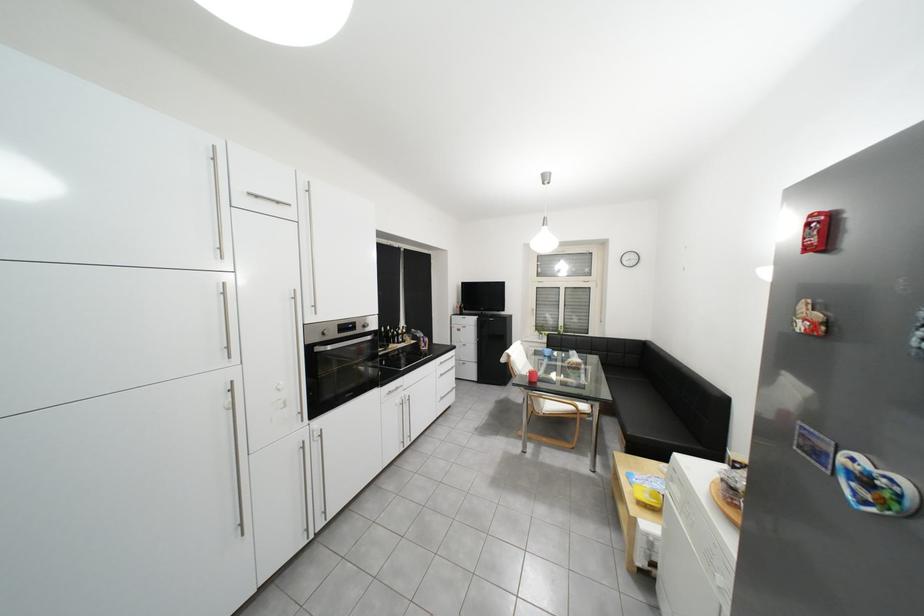
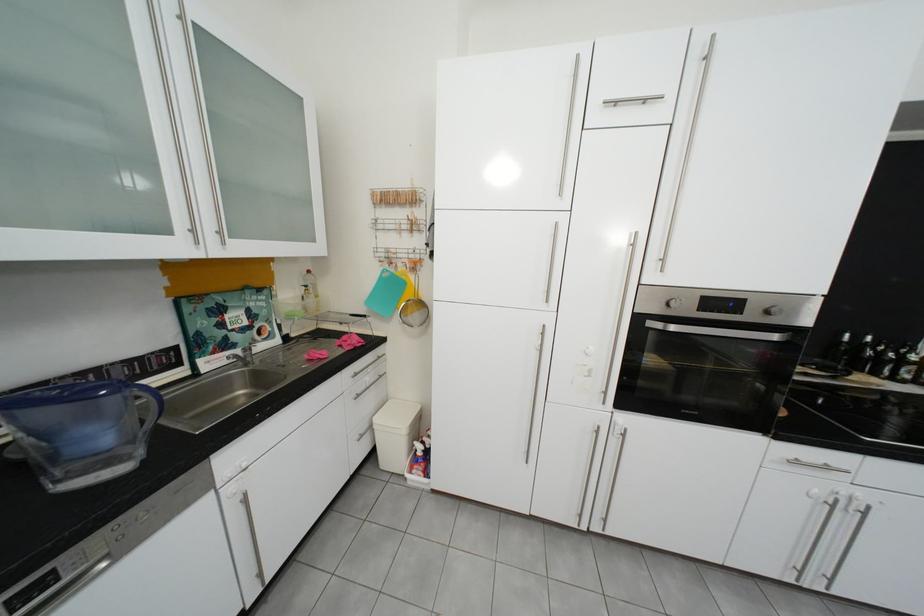
The point at [397,330] is marked in the first image. Where is the corresponding point in the second image?

(869, 339)